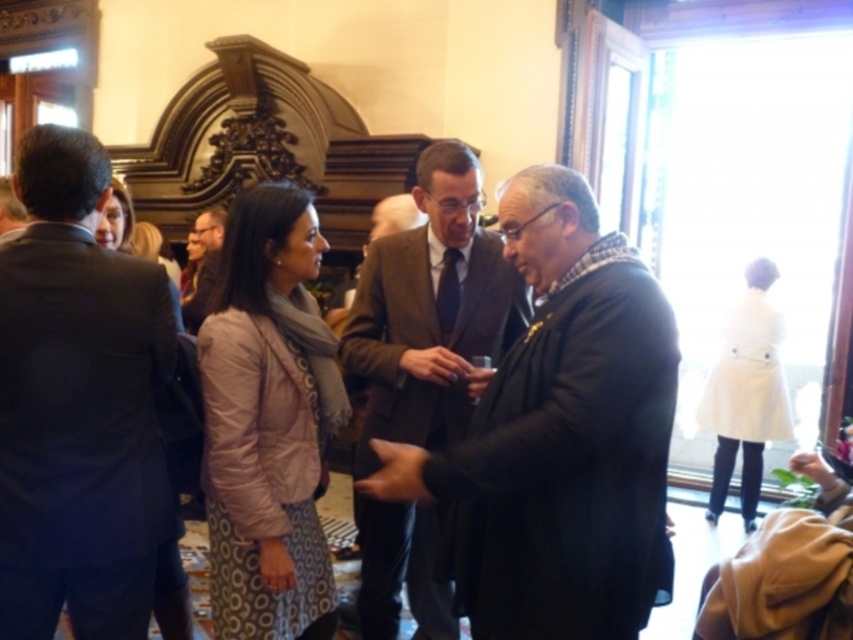
Can you confirm if brown wool suit at center is positioned below matte brown suit at center?

Correct, brown wool suit at center is located below matte brown suit at center.

Does brown wool suit at center have a lesser height compared to matte brown suit at center?

No.

What do you see at coordinates (431, 310) in the screenshot?
I see `brown wool suit at center` at bounding box center [431, 310].

Where is `brown wool suit at center`? brown wool suit at center is located at coordinates (431, 310).

Locate an element on the screen. The height and width of the screenshot is (640, 853). dark blue suit at left is located at coordinates (78, 403).

Between dark blue suit at left and brown wool suit at center, which one appears on the right side from the viewer's perspective?

From the viewer's perspective, brown wool suit at center appears more on the right side.

Between point (9, 353) and point (387, 362), which one is positioned in front?

Point (9, 353) is more forward.

Locate an element on the screen. This screenshot has height=640, width=853. dark blue suit at left is located at coordinates (78, 403).

Is the position of dark blue suit at left less distant than that of matte brown suit at center?

Yes, it is.

Does point (0, 268) come farther from viewer compared to point (216, 273)?

No, it is not.

You are a GUI agent. You are given a task and a screenshot of the screen. Output one action in this format:
    pyautogui.click(x=<x>, y=<y>)
    Task: Click on the dark blue suit at left
    This screenshot has width=853, height=640.
    Given the screenshot: What is the action you would take?
    pyautogui.click(x=78, y=403)